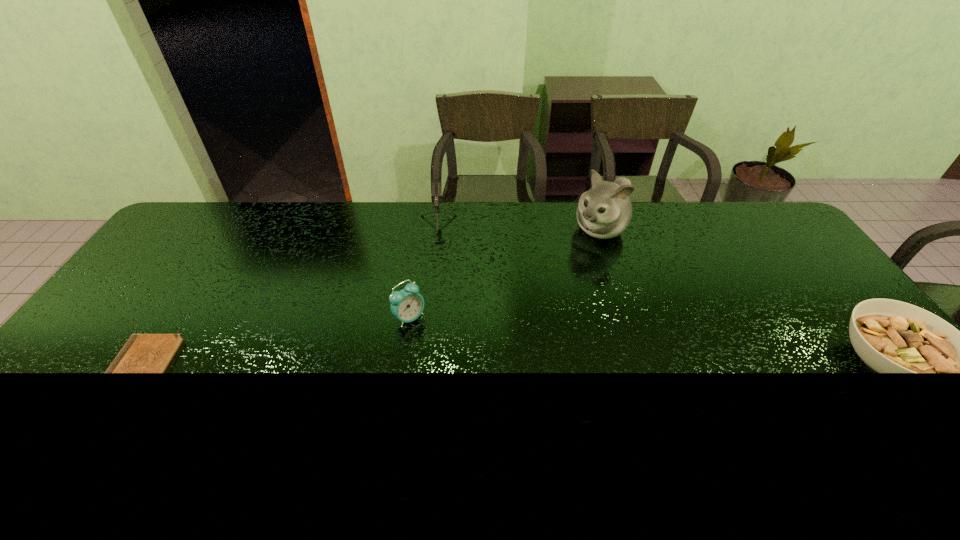
You are a GUI agent. You are given a task and a screenshot of the screen. Output one action in this format:
    pyautogui.click(x=<x>, y=<y>)
    Task: Click on the free location located 0.100m on the stand of the microphone
    
    Given the screenshot: What is the action you would take?
    pyautogui.click(x=432, y=275)

Find the location of a particular element. Image resolution: width=960 pixels, height=540 pixels. free location located 0.270m on the face of the hamster is located at coordinates (542, 288).

Locate an element on the screen. This screenshot has height=540, width=960. vacant region located 0.210m on the face of the hamster is located at coordinates (553, 278).

The width and height of the screenshot is (960, 540). What are the coordinates of `vacant point located 0.090m on the face of the hamster` in the screenshot? It's located at (573, 258).

At what (x,y) coordinates should I click in order to perform the action: click on blank area located on the face of the alarm clock. Please return your answer as a coordinate pair (x, y). Image resolution: width=960 pixels, height=540 pixels. Looking at the image, I should click on (511, 379).

At what (x,y) coordinates should I click in order to perform the action: click on vacant space situated 0.330m on the face of the alarm clock. Please return your answer as a coordinate pair (x, y). The height and width of the screenshot is (540, 960). Looking at the image, I should click on (520, 386).

Find the location of a particular element. vacant region located 0.300m on the face of the alarm clock is located at coordinates (511, 379).

The height and width of the screenshot is (540, 960). I want to click on microphone positioned at the far edge, so click(436, 186).

At what (x,y) coordinates should I click in order to perform the action: click on hamster located in the far edge section of the desktop. Please return your answer as a coordinate pair (x, y). This screenshot has height=540, width=960. Looking at the image, I should click on (604, 211).

I want to click on object located at the near edge, so click(x=143, y=353).